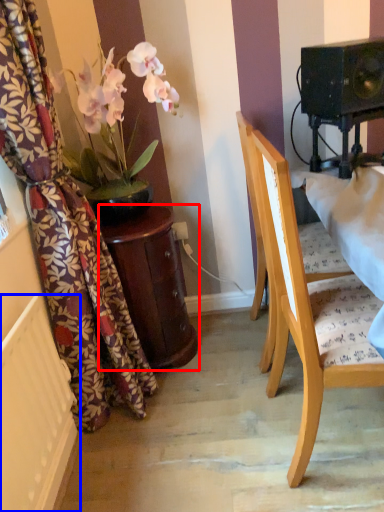
Question: Among these objects, which one is nearest to the camera, table (highlighted by a red box) or radiator (highlighted by a blue box)?

Choices:
 (A) table
 (B) radiator

Answer: (B)